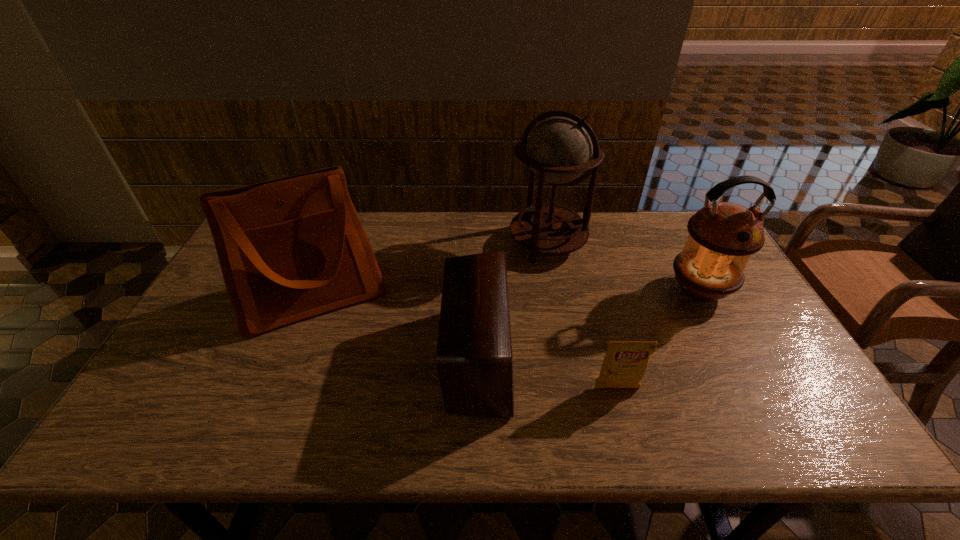
Locate an element on the screen. vacant area that lies between the shortest object and the second shortest object is located at coordinates (547, 373).

This screenshot has width=960, height=540. Find the location of `unoccupied position between the leftmost object and the second object from left to right`. unoccupied position between the leftmost object and the second object from left to right is located at coordinates (396, 327).

Identify the location of free space between the tallest object and the leftmost object. The height and width of the screenshot is (540, 960). (431, 269).

You are a GUI agent. You are given a task and a screenshot of the screen. Output one action in this format:
    pyautogui.click(x=<x>, y=<y>)
    Task: Click on the free spot between the crisp (potato chip) and the rightmost object
    The width and height of the screenshot is (960, 540).
    Given the screenshot: What is the action you would take?
    pyautogui.click(x=658, y=340)

Where is `free area in between the globe and the rightmost object`? free area in between the globe and the rightmost object is located at coordinates (623, 267).

Where is `free space between the shopping bag and the tallest object`? This screenshot has height=540, width=960. free space between the shopping bag and the tallest object is located at coordinates click(x=431, y=269).

Find the location of a particular element. This screenshot has width=960, height=540. vacant area between the tallest object and the crisp (potato chip) is located at coordinates (582, 315).

In order to click on unoccupied position between the leftmost object and the globe in this screenshot , I will do `click(431, 269)`.

Where is `unoccupied position between the second shortest object and the oil lamp`? unoccupied position between the second shortest object and the oil lamp is located at coordinates (588, 324).

Select which object appears as the fourth closest to the globe. Please provide its 2D coordinates. Your answer should be formatted as a tuple, i.e. [(x, y)], where the tuple contains the x and y coordinates of a point satisfying the conditions above.

[(624, 365)]